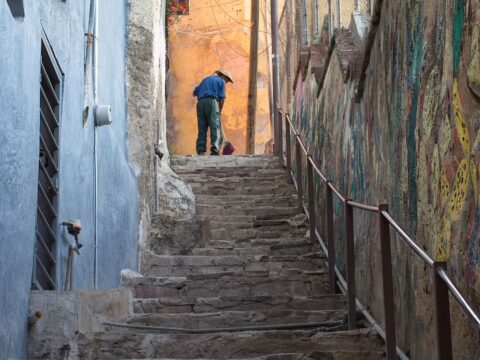
The image size is (480, 360). Find the location of `vertical railing posts`. vertical railing posts is located at coordinates (281, 125), (285, 142), (295, 164), (311, 185), (327, 212), (345, 226), (385, 249), (444, 303).